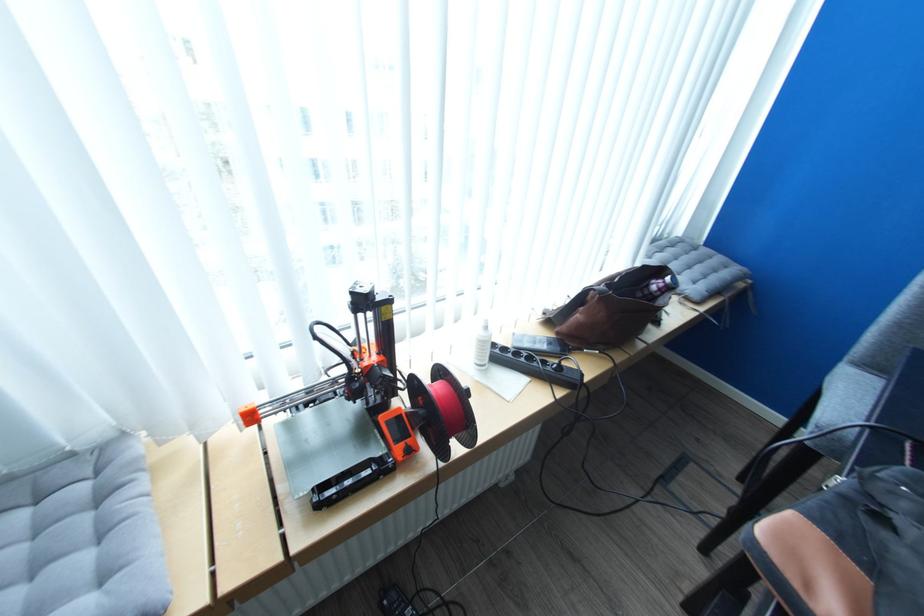
The image size is (924, 616). In order to click on white bottle nozzle in this screenshot , I will do `click(482, 337)`.